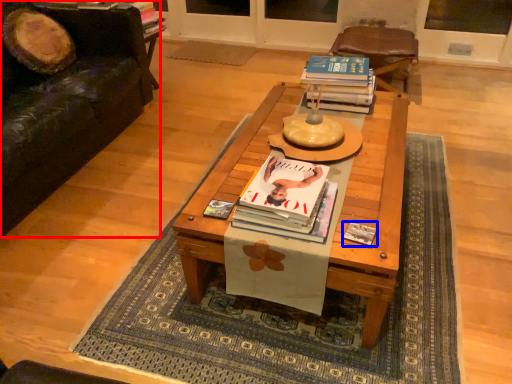
Question: Which point is further to the camera, studio couch (highlighted by a red box) or paperback book (highlighted by a blue box)?

Choices:
 (A) studio couch
 (B) paperback book

Answer: (A)